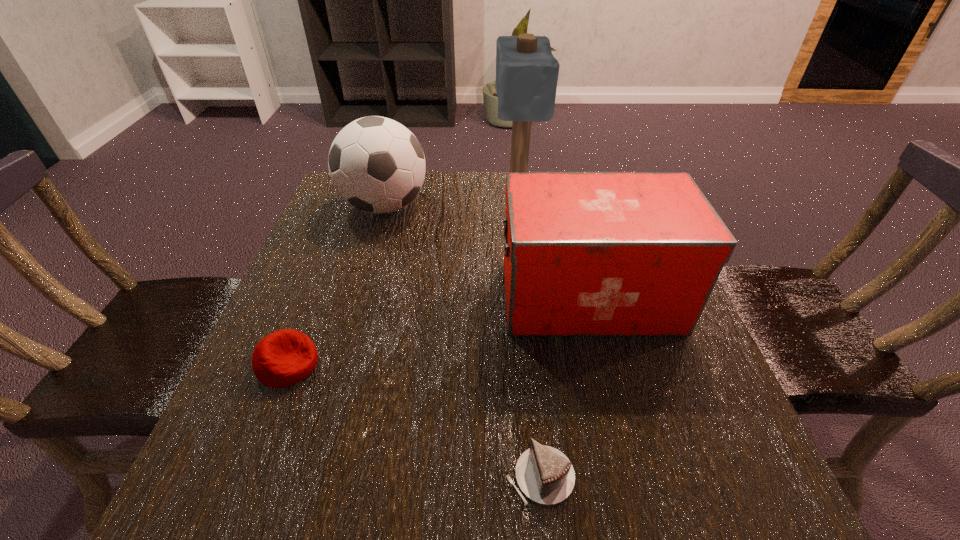
The width and height of the screenshot is (960, 540). In order to click on free spot between the tallest object and the second shortest object in this screenshot , I will do `click(402, 278)`.

I want to click on blank region between the soccer ball and the tallest object, so click(451, 199).

Where is `the fourth closest object relative to the first-aid kit`? This screenshot has height=540, width=960. the fourth closest object relative to the first-aid kit is located at coordinates (283, 358).

Identify which object is the third closest to the soccer ball. Please provide its 2D coordinates. Your answer should be formatted as a tuple, i.e. [(x, y)], where the tuple contains the x and y coordinates of a point satisfying the conditions above.

[(283, 358)]

Where is `vacant region that satisfies the following two spatial constraints: 1. on the back side of the tallest object; 2. on the left side of the shortest object`? vacant region that satisfies the following two spatial constraints: 1. on the back side of the tallest object; 2. on the left side of the shortest object is located at coordinates (512, 192).